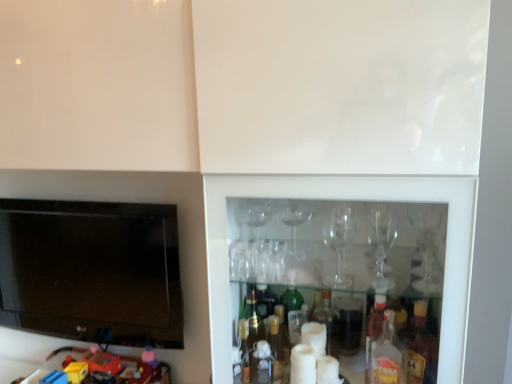
The image size is (512, 384). Identify the location of black glossy flat-screen tv at left. (91, 270).

Describe the element at coordinates (91, 270) in the screenshot. This screenshot has width=512, height=384. I see `black glossy flat-screen tv at left` at that location.

The image size is (512, 384). I want to click on plastic toy car at lower left, so click(120, 367).

What do you see at coordinates (120, 367) in the screenshot? The width and height of the screenshot is (512, 384). I see `plastic toy car at lower left` at bounding box center [120, 367].

At what (x,y) coordinates should I click in order to perform the action: click on black glossy flat-screen tv at left. Please return your answer as a coordinate pair (x, y). The width and height of the screenshot is (512, 384). Looking at the image, I should click on (91, 270).

Can you confirm if plastic toy car at lower left is positioned to the right of black glossy flat-screen tv at left?

Yes.

Is plastic toy car at lower left in front of black glossy flat-screen tv at left?

Yes, it is.

Does point (47, 368) appear closer or farther from the camera than point (37, 265)?

Point (47, 368) is positioned closer to the camera compared to point (37, 265).

From the image's perspective, relative to black glossy flat-screen tv at left, is plastic toy car at lower left above or below?

From the image's perspective, plastic toy car at lower left appears below black glossy flat-screen tv at left.

From a real-world perspective, who is located higher, plastic toy car at lower left or black glossy flat-screen tv at left?

black glossy flat-screen tv at left, from a real-world perspective.

Considering the relative sizes of plastic toy car at lower left and black glossy flat-screen tv at left in the image provided, is plastic toy car at lower left thinner than black glossy flat-screen tv at left?

No, plastic toy car at lower left is not thinner than black glossy flat-screen tv at left.

Based on the photo, from their relative heights in the image, would you say plastic toy car at lower left is taller or shorter than black glossy flat-screen tv at left?

plastic toy car at lower left is shorter than black glossy flat-screen tv at left.

Considering the relative sizes of plastic toy car at lower left and black glossy flat-screen tv at left in the image provided, is plastic toy car at lower left smaller than black glossy flat-screen tv at left?

Yes.

Is plastic toy car at lower left outside of black glossy flat-screen tv at left?

plastic toy car at lower left lies outside black glossy flat-screen tv at left's area.

Is plastic toy car at lower left not close to black glossy flat-screen tv at left?

No.

Could you tell me if plastic toy car at lower left is facing black glossy flat-screen tv at left?

No.

Can you tell me how much plastic toy car at lower left and black glossy flat-screen tv at left differ in facing direction?

90.9 degrees separate the facing orientations of plastic toy car at lower left and black glossy flat-screen tv at left.

Measure the distance from plastic toy car at lower left to black glossy flat-screen tv at left.

11.31 inches.

Find the location of a particular element. The width and height of the screenshot is (512, 384). television located above the plastic toy car at lower left (from a real-world perspective) is located at coordinates (91, 270).

Between black glossy flat-screen tv at left and plastic toy car at lower left, which one appears on the left side from the viewer's perspective?

From the viewer's perspective, black glossy flat-screen tv at left appears more on the left side.

Considering their positions, is black glossy flat-screen tv at left located in front of or behind plastic toy car at lower left?

black glossy flat-screen tv at left is positioned farther from the viewer than plastic toy car at lower left.

Which point is more distant from viewer, (96, 332) or (91, 353)?

The point (91, 353) is more distant.

From the image's perspective, is black glossy flat-screen tv at left positioned above or below plastic toy car at lower left?

black glossy flat-screen tv at left is above plastic toy car at lower left.

From a real-world perspective, is black glossy flat-screen tv at left positioned above or below plastic toy car at lower left?

From a real-world perspective, black glossy flat-screen tv at left is physically above plastic toy car at lower left.

In terms of width, does black glossy flat-screen tv at left look wider or thinner when compared to plastic toy car at lower left?

Considering their sizes, black glossy flat-screen tv at left looks slimmer than plastic toy car at lower left.

Which of these two, black glossy flat-screen tv at left or plastic toy car at lower left, stands shorter?

plastic toy car at lower left is shorter.

Based on their sizes in the image, would you say black glossy flat-screen tv at left is bigger or smaller than plastic toy car at lower left?

Considering their sizes, black glossy flat-screen tv at left takes up more space than plastic toy car at lower left.

In the scene shown: Can we say black glossy flat-screen tv at left lies outside plastic toy car at lower left?

black glossy flat-screen tv at left lies outside plastic toy car at lower left's area.

Is black glossy flat-screen tv at left next to plastic toy car at lower left and touching it?

No, black glossy flat-screen tv at left is not touching plastic toy car at lower left.

Is black glossy flat-screen tv at left looking in the opposite direction of plastic toy car at lower left?

No.

How different are the orientations of black glossy flat-screen tv at left and plastic toy car at lower left in degrees?

black glossy flat-screen tv at left and plastic toy car at lower left are facing 90.9 degrees away from each other.

Find the location of a particular element. This screenshot has height=384, width=512. toy in front of the black glossy flat-screen tv at left is located at coordinates (120, 367).

Identify the location of toy located underneath the black glossy flat-screen tv at left (from a real-world perspective). The height and width of the screenshot is (384, 512). click(x=120, y=367).

This screenshot has height=384, width=512. In order to click on television above the plastic toy car at lower left (from the image's perspective) in this screenshot , I will do `click(91, 270)`.